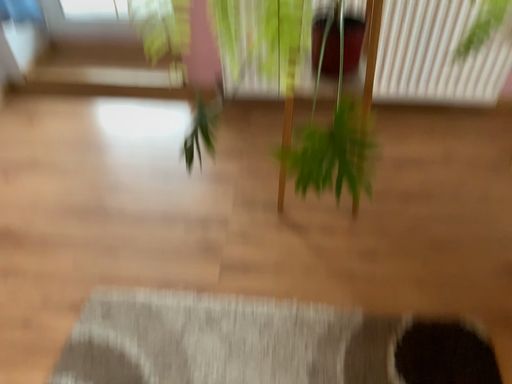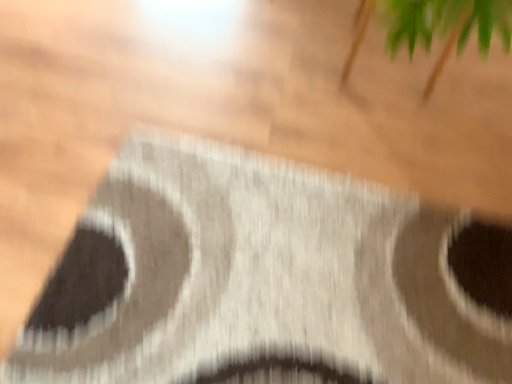
Question: Which way did the camera rotate in the video?

Choices:
 (A) rotated downward
 (B) rotated upward

Answer: (A)